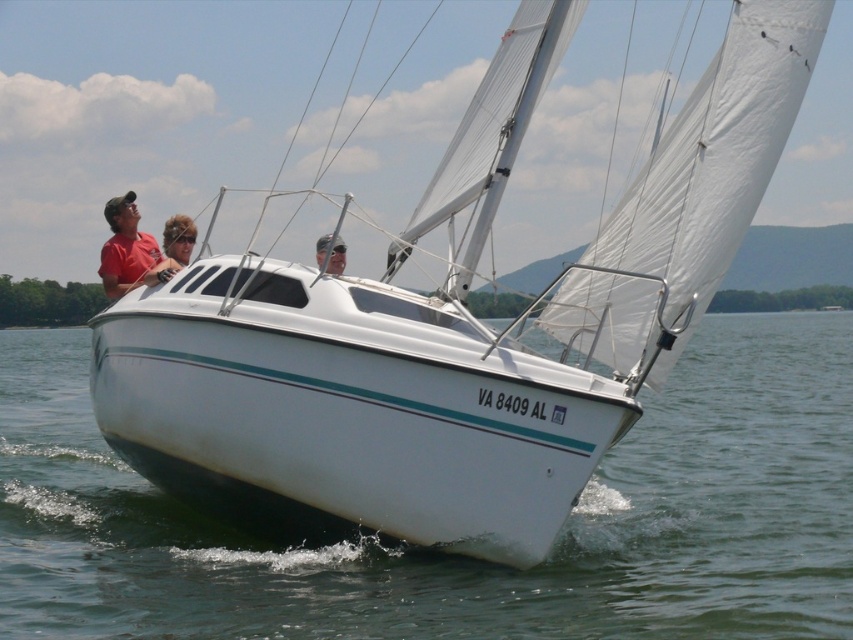
Is point (128, 225) less distant than point (326, 272)?

No, it is behind (326, 272).

Does matte red shirt at upper left have a greater width compared to matte pink hair at center?

No, matte red shirt at upper left is not wider than matte pink hair at center.

Who is more forward, (144, 243) or (315, 244)?

Point (144, 243) is more forward.

Locate an element on the screen. matte red shirt at upper left is located at coordinates (131, 250).

The width and height of the screenshot is (853, 640). I want to click on white water at lower center, so click(x=456, y=556).

Is point (219, 632) less distant than point (123, 273)?

Yes, it is in front of point (123, 273).

You are a GUI agent. You are given a task and a screenshot of the screen. Output one action in this format:
    pyautogui.click(x=<x>, y=<y>)
    Task: Click on the white water at lower center
    
    Given the screenshot: What is the action you would take?
    pyautogui.click(x=456, y=556)

What do you see at coordinates (456, 556) in the screenshot?
I see `white water at lower center` at bounding box center [456, 556].

Describe the element at coordinates (456, 556) in the screenshot. Image resolution: width=853 pixels, height=640 pixels. I see `white water at lower center` at that location.

Find the location of a particular element. The height and width of the screenshot is (640, 853). white water at lower center is located at coordinates [x=456, y=556].